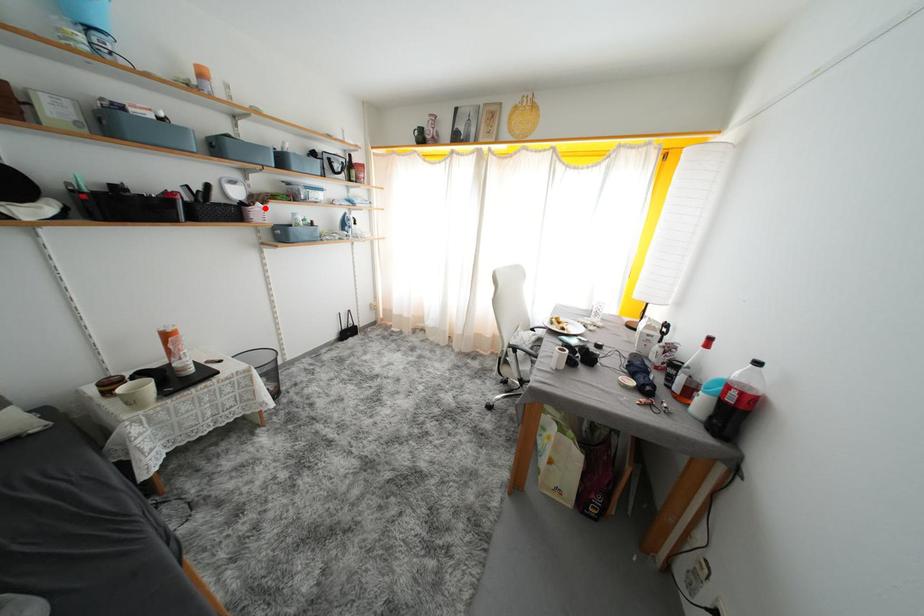
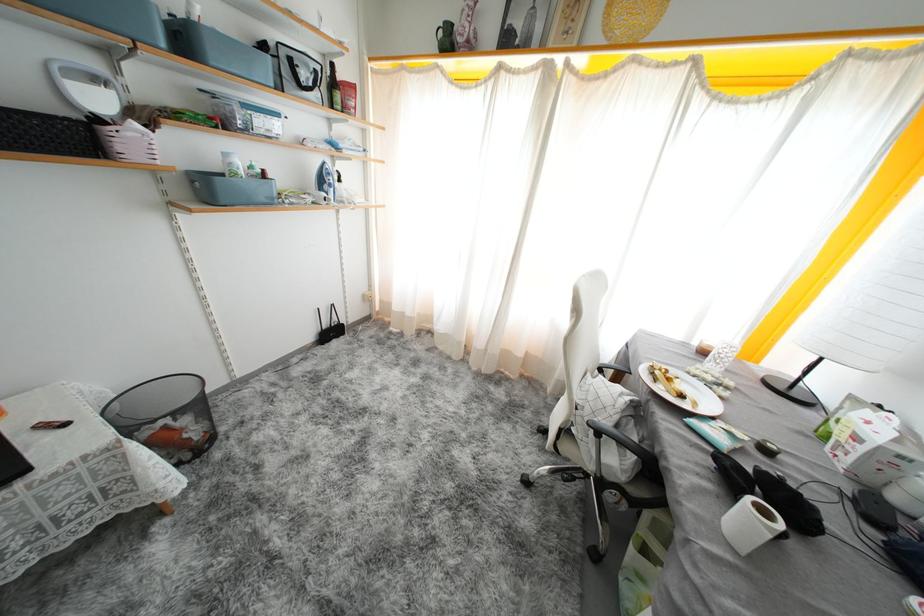
Question: I am providing you with two images of the same scene from different viewpoints. Image1 has a red point marked. In image2, the corresponding 3D location appears at what relative position? Reply with the corresponding letter.

Choices:
 (A) Closer
 (B) Farther

Answer: (B)